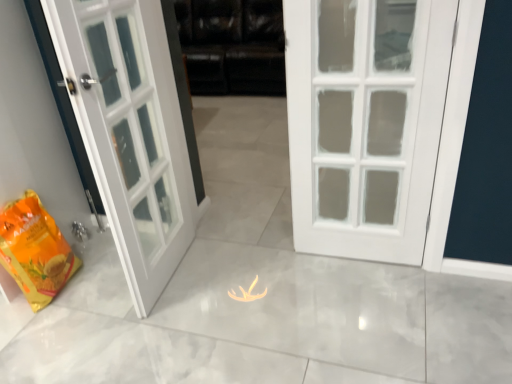
Question: Would you say black leather couch at center is outside yellow matte shopping bag at lower left?

Choices:
 (A) no
 (B) yes

Answer: (B)

Question: From the image's perspective, would you say black leather couch at center is shown under yellow matte shopping bag at lower left?

Choices:
 (A) yes
 (B) no

Answer: (B)

Question: Does black leather couch at center have a greater width compared to yellow matte shopping bag at lower left?

Choices:
 (A) no
 (B) yes

Answer: (B)

Question: Is black leather couch at center closer to the viewer compared to yellow matte shopping bag at lower left?

Choices:
 (A) no
 (B) yes

Answer: (A)

Question: Are black leather couch at center and yellow matte shopping bag at lower left far apart?

Choices:
 (A) yes
 (B) no

Answer: (A)

Question: Does black leather couch at center have a lesser height compared to yellow matte shopping bag at lower left?

Choices:
 (A) no
 (B) yes

Answer: (A)

Question: Is yellow matte shopping bag at lower left positioned far away from black leather couch at center?

Choices:
 (A) no
 (B) yes

Answer: (B)

Question: Is yellow matte shopping bag at lower left not within black leather couch at center?

Choices:
 (A) yes
 (B) no

Answer: (A)

Question: Does yellow matte shopping bag at lower left lie in front of black leather couch at center?

Choices:
 (A) yes
 (B) no

Answer: (A)

Question: From a real-world perspective, is yellow matte shopping bag at lower left located beneath black leather couch at center?

Choices:
 (A) yes
 (B) no

Answer: (A)

Question: Considering the relative sizes of yellow matte shopping bag at lower left and black leather couch at center in the image provided, is yellow matte shopping bag at lower left thinner than black leather couch at center?

Choices:
 (A) yes
 (B) no

Answer: (A)

Question: Is yellow matte shopping bag at lower left bigger than black leather couch at center?

Choices:
 (A) yes
 (B) no

Answer: (B)

Question: Is point (227, 38) positioned closer to the camera than point (39, 304)?

Choices:
 (A) farther
 (B) closer

Answer: (A)